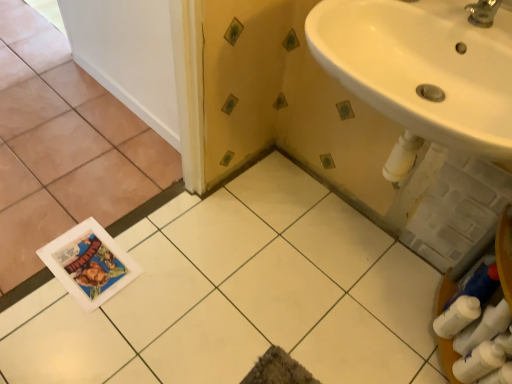
Where is `vacant space situated on the left part of white smooth door at upper left`? vacant space situated on the left part of white smooth door at upper left is located at coordinates (56, 91).